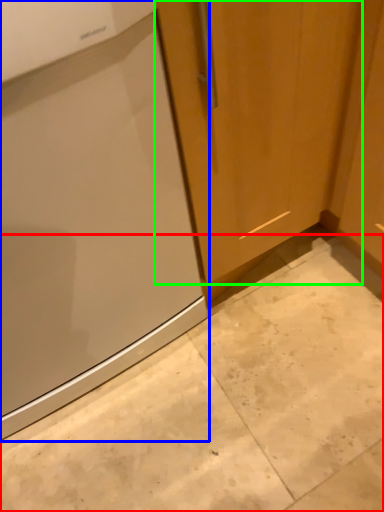
Question: Considering the real-world distances, which object is closest to concrete (highlighted by a red box)? home appliance (highlighted by a blue box) or door (highlighted by a green box).

Choices:
 (A) home appliance
 (B) door

Answer: (A)